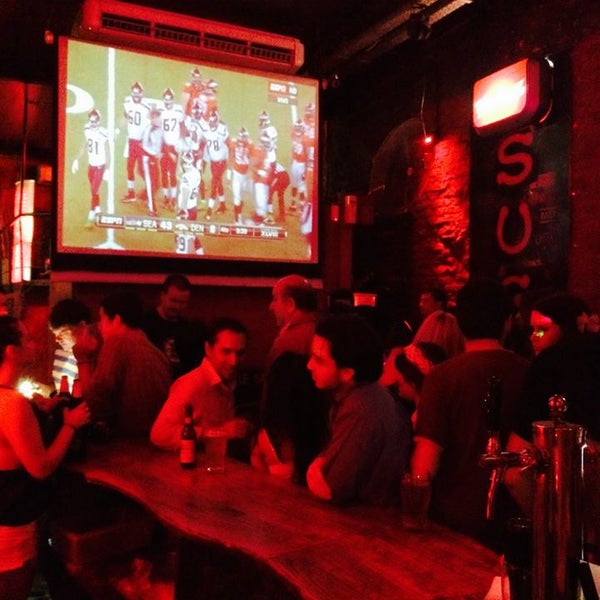
At what (x,y) coordinates should I click in order to perform the action: click on light. Please return your answer as a coordinate pair (x, y). The width and height of the screenshot is (600, 600). Looking at the image, I should click on coord(4,261), coord(9,202).